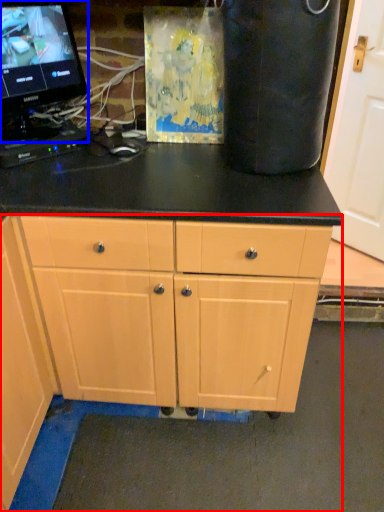
Question: Which of the following is the farthest to the observer, cabinet (highlighted by a red box) or computer monitor (highlighted by a blue box)?

Choices:
 (A) cabinet
 (B) computer monitor

Answer: (B)